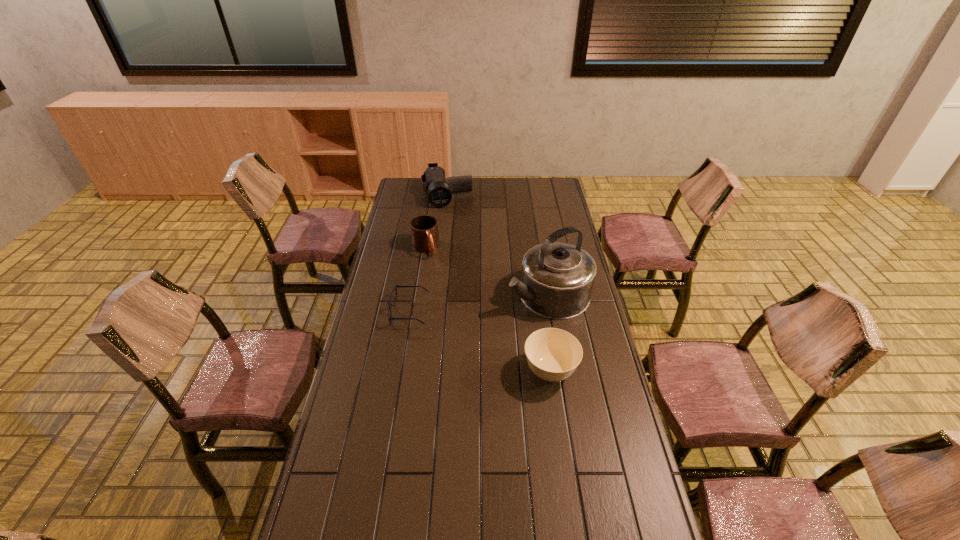
Image resolution: width=960 pixels, height=540 pixels. What are the coordinates of `sugar bowl at the right edge` in the screenshot? It's located at (552, 354).

Find the location of a particular element. This screenshot has width=960, height=540. kettle at the right edge is located at coordinates (557, 279).

At what (x,y) coordinates should I click in order to perform the action: click on object located in the far left corner section of the desktop. Please return your answer as a coordinate pair (x, y). The width and height of the screenshot is (960, 540). Looking at the image, I should click on (439, 192).

You are a GUI agent. You are given a task and a screenshot of the screen. Output one action in this format:
    pyautogui.click(x=<x>, y=<y>)
    Task: Click on the free space at the far edge of the desktop
    
    Given the screenshot: What is the action you would take?
    pyautogui.click(x=492, y=192)

In the image, there is a desktop. At what (x,y) coordinates should I click in order to perform the action: click on blank space at the near edge. Please return your answer as a coordinate pair (x, y). The width and height of the screenshot is (960, 540). Looking at the image, I should click on (493, 523).

Where is `vacant space at the left edge of the desktop`? The width and height of the screenshot is (960, 540). vacant space at the left edge of the desktop is located at coordinates (371, 301).

The height and width of the screenshot is (540, 960). In the image, there is a desktop. Identify the location of free space at the right edge. (590, 356).

Where is `vacant space at the far left corner of the desktop`? vacant space at the far left corner of the desktop is located at coordinates (407, 182).

At what (x,y) coordinates should I click in order to perform the action: click on vacant point at the near left corner. Please return your answer as a coordinate pair (x, y). This screenshot has width=960, height=540. Looking at the image, I should click on (345, 517).

Find the location of `vacant space at the far right corner`. vacant space at the far right corner is located at coordinates (557, 191).